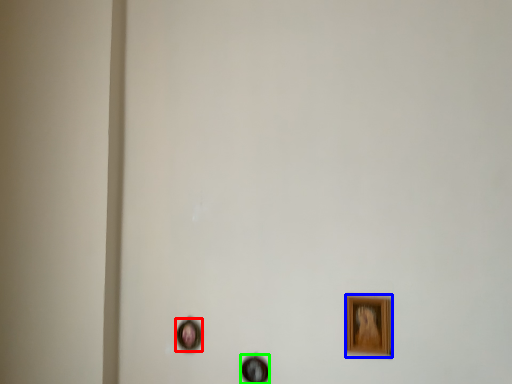
Question: Which object is positioned farthest from picture frame (highlighted by a red box)? Select from picture frame (highlighted by a blue box) and picture frame (highlighted by a green box).

Choices:
 (A) picture frame
 (B) picture frame

Answer: (A)